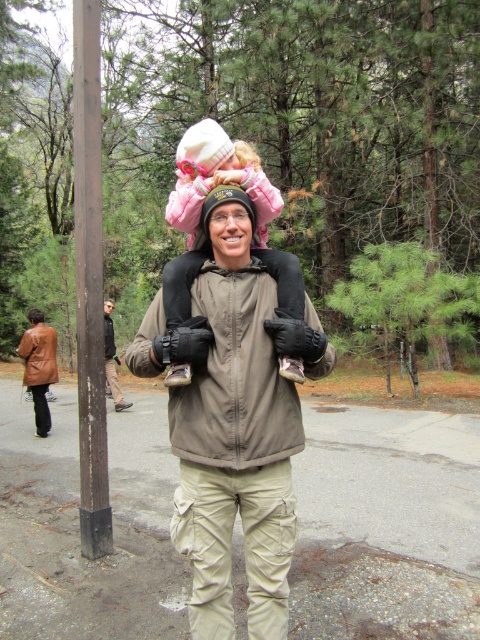
Who is lower down, brown wood pole at left or matte pink jacket at upper center?

brown wood pole at left is lower down.

Between point (86, 301) and point (207, 160), which one is positioned in front?

Positioned in front is point (207, 160).

Which is behind, point (97, 106) or point (180, 285)?

Point (97, 106)

Locate an element on the screen. brown wood pole at left is located at coordinates (90, 282).

Which is behind, point (44, 381) or point (121, 408)?

Positioned behind is point (121, 408).

Does brown leather jacket at lower left come behind brown leather jacket at center?

That is False.

Is point (43, 401) positioned before point (108, 374)?

Yes, point (43, 401) is closer to viewer.

This screenshot has width=480, height=640. What are the coordinates of `brown leather jacket at lower left` in the screenshot? It's located at (38, 365).

Based on the photo, does matte brown jacket at center lie in front of brown leather jacket at center?

Yes, matte brown jacket at center is in front of brown leather jacket at center.

Looking at this image, is matte brown jacket at center wider than brown leather jacket at center?

Correct, the width of matte brown jacket at center exceeds that of brown leather jacket at center.

Who is more forward, (199, 612) or (108, 356)?

Positioned in front is point (199, 612).

The height and width of the screenshot is (640, 480). Find the location of `matte brown jacket at center`. matte brown jacket at center is located at coordinates (233, 422).